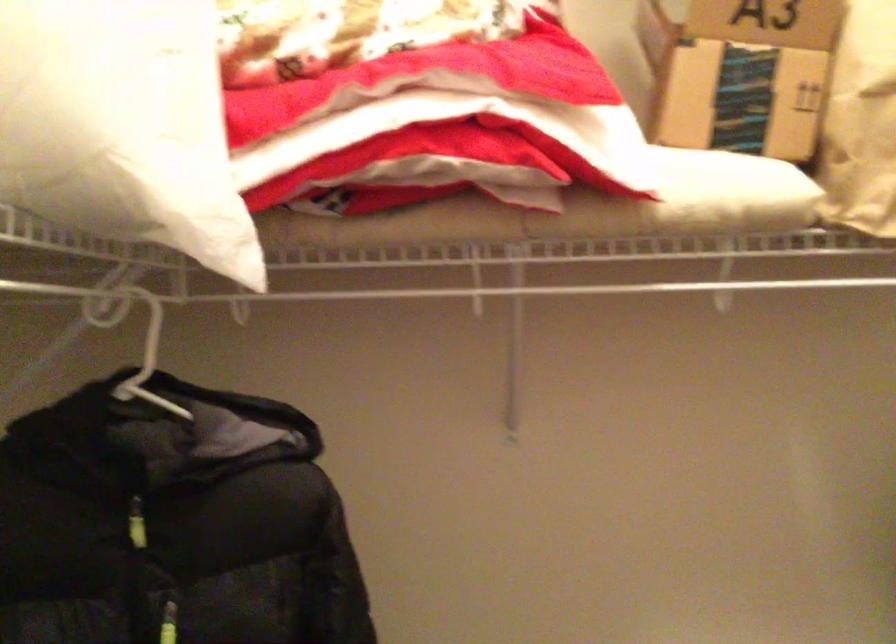
Where is `white clothes hanger`? The width and height of the screenshot is (896, 644). white clothes hanger is located at coordinates (138, 344).